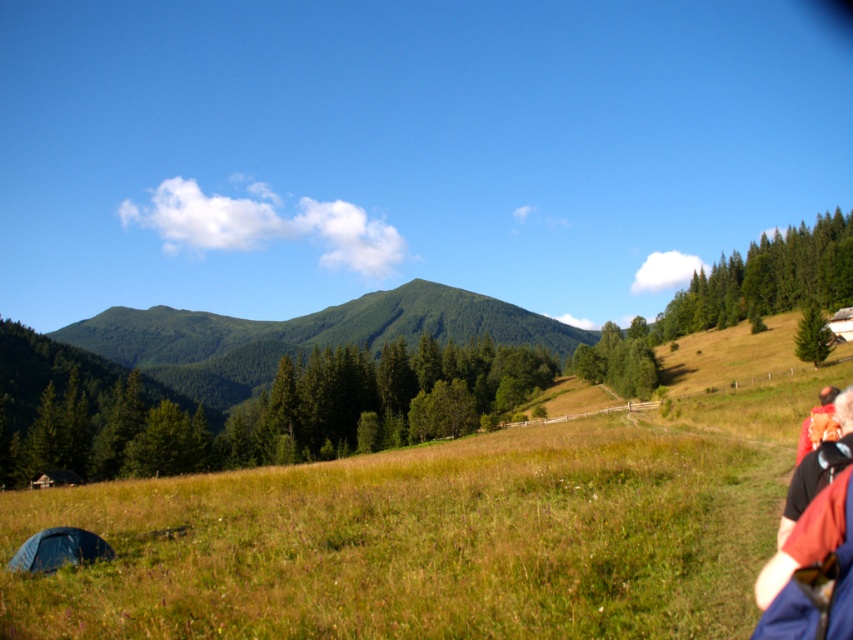
Question: Which point is farther to the camera?

Choices:
 (A) (851, 420)
 (B) (65, 556)
 (C) (821, 401)

Answer: (C)

Question: Among these points, which one is farthest from the camera?

Choices:
 (A) [833, 406]
 (B) [819, 392]

Answer: (B)

Question: Can you confirm if red fabric jacket at lower right is smaller than dark blue fabric tent at lower left?

Choices:
 (A) yes
 (B) no

Answer: (B)

Question: Does red fabric jacket at lower right appear on the left side of dark blue fabric tent at lower left?

Choices:
 (A) yes
 (B) no

Answer: (B)

Question: Which of these objects is positioned closest to the red fabric jacket at lower right?

Choices:
 (A) dark blue fabric tent at lower left
 (B) camouflage jacket at lower right

Answer: (B)

Question: Is red fabric jacket at lower right smaller than camouflage jacket at lower right?

Choices:
 (A) yes
 (B) no

Answer: (A)